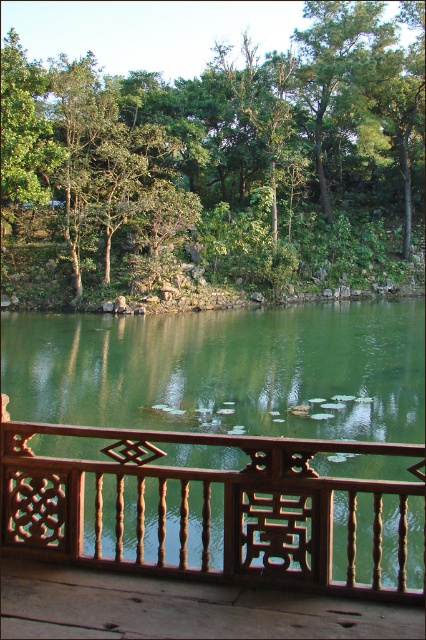
Question: Based on their relative distances, which object is nearer to the green leafy tree at center?

Choices:
 (A) wooden at lower center
 (B) brown wood balcony at center

Answer: (B)

Question: Is brown wood balcony at center smaller than wooden at lower center?

Choices:
 (A) no
 (B) yes

Answer: (A)

Question: Can you confirm if brown wood balcony at center is positioned below wooden at lower center?

Choices:
 (A) no
 (B) yes

Answer: (B)

Question: Which point appears closest to the camera in this image?

Choices:
 (A) (54, 548)
 (B) (100, 572)

Answer: (B)

Question: Among these points, which one is nearest to the camera?

Choices:
 (A) (97, 612)
 (B) (304, 534)

Answer: (A)

Question: In this image, where is green leafy tree at center located relative to brown wood balcony at center?

Choices:
 (A) above
 (B) below

Answer: (A)